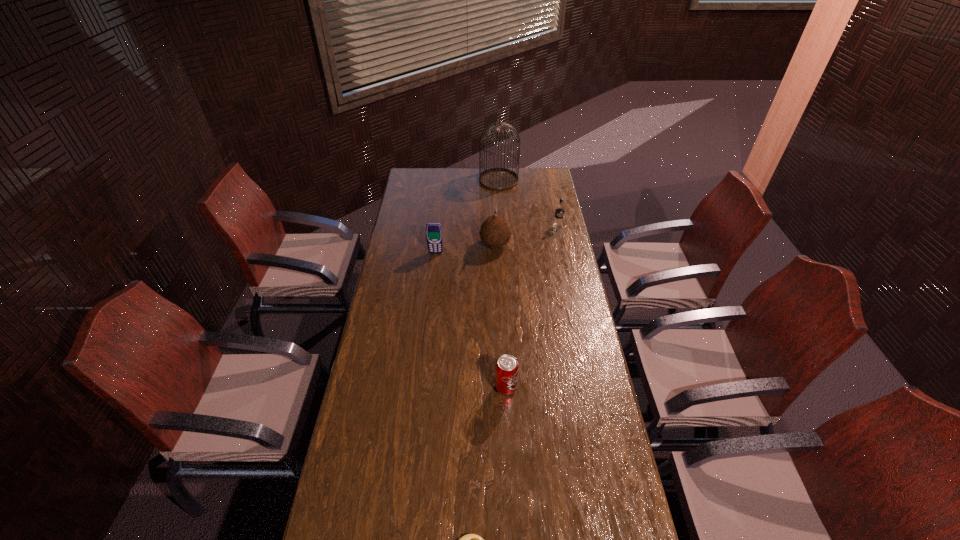
In order to click on free space located 0.280m on the surface of the fifth shortest object in this screenshot , I will do `click(420, 245)`.

The image size is (960, 540). In order to click on blank space located 0.360m on the front-facing side of the leftmost object in this screenshot , I will do `click(429, 312)`.

This screenshot has height=540, width=960. I want to click on vacant area situated on the label of the fifth nearest object, so click(563, 247).

Identify the location of vacant space situated on the left of the second nearest object. (404, 388).

Identify the location of object that is at the far edge. (498, 179).

Find the location of `object at the right edge`. object at the right edge is located at coordinates (559, 211).

The image size is (960, 540). I want to click on free space at the far edge of the desktop, so click(x=452, y=173).

Locate an element on the screen. vacant region at the left edge of the desktop is located at coordinates (350, 524).

In order to click on free space at the right edge in this screenshot , I will do `click(545, 217)`.

Where is `vacant region at the far right corner of the desktop`? This screenshot has width=960, height=540. vacant region at the far right corner of the desktop is located at coordinates (554, 187).